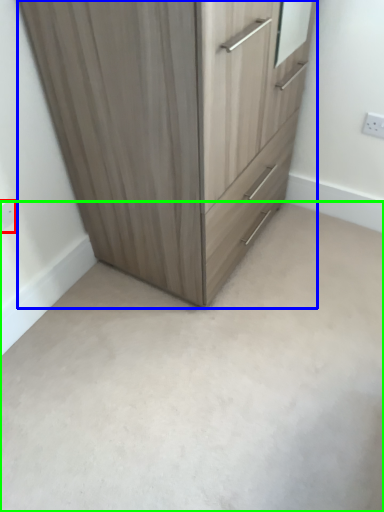
Question: Based on their relative distances, which object is farther from electric outlet (highlighted by a red box)? Choose from chest of drawers (highlighted by a blue box) and concrete (highlighted by a green box).

Choices:
 (A) chest of drawers
 (B) concrete

Answer: (B)